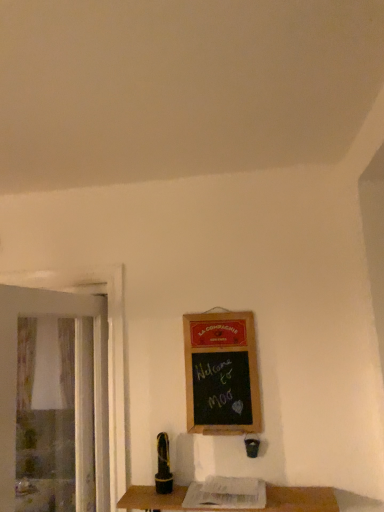
Question: Is wooden table at lower center not inside transparent plastic screen door at left?

Choices:
 (A) no
 (B) yes

Answer: (B)

Question: Does wooden table at lower center have a lesser height compared to transparent plastic screen door at left?

Choices:
 (A) no
 (B) yes

Answer: (B)

Question: From a real-world perspective, is wooden table at lower center on top of transparent plastic screen door at left?

Choices:
 (A) yes
 (B) no

Answer: (B)

Question: Considering the relative positions of wooden table at lower center and transparent plastic screen door at left in the image provided, is wooden table at lower center to the right of transparent plastic screen door at left from the viewer's perspective?

Choices:
 (A) no
 (B) yes

Answer: (B)

Question: From the image's perspective, would you say wooden table at lower center is shown under transparent plastic screen door at left?

Choices:
 (A) no
 (B) yes

Answer: (B)

Question: From the image's perspective, relative to wooden table at lower center, is wooden framed chalkboard at center-right above or below?

Choices:
 (A) below
 (B) above

Answer: (B)

Question: Based on their positions, is wooden framed chalkboard at center-right located to the left or right of wooden table at lower center?

Choices:
 (A) right
 (B) left

Answer: (B)

Question: In terms of size, does wooden framed chalkboard at center-right appear bigger or smaller than wooden table at lower center?

Choices:
 (A) small
 (B) big

Answer: (A)

Question: In terms of height, does wooden framed chalkboard at center-right look taller or shorter compared to wooden table at lower center?

Choices:
 (A) tall
 (B) short

Answer: (A)

Question: Considering the positions of wooden framed chalkboard at center-right and transparent plastic screen door at left in the image, is wooden framed chalkboard at center-right taller or shorter than transparent plastic screen door at left?

Choices:
 (A) tall
 (B) short

Answer: (B)

Question: From the image's perspective, is wooden framed chalkboard at center-right above or below transparent plastic screen door at left?

Choices:
 (A) above
 (B) below

Answer: (A)

Question: Is wooden framed chalkboard at center-right inside the boundaries of transparent plastic screen door at left, or outside?

Choices:
 (A) outside
 (B) inside

Answer: (A)

Question: From a real-world perspective, is wooden framed chalkboard at center-right above or below transparent plastic screen door at left?

Choices:
 (A) above
 (B) below

Answer: (A)

Question: From a real-world perspective, relative to wooden table at lower center, is transparent plastic screen door at left vertically above or below?

Choices:
 (A) below
 (B) above

Answer: (B)

Question: Does point (72, 311) appear closer or farther from the camera than point (309, 506)?

Choices:
 (A) closer
 (B) farther

Answer: (B)